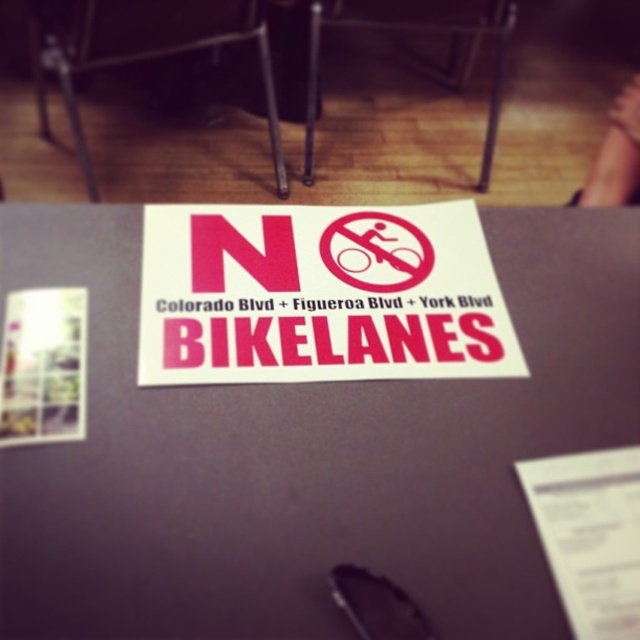
From the picture: You are standing at the origin point of the coordinate system. Which direction should you move to reach the purple matte paper at center?

The purple matte paper at center is located at coordinate point 0.711 on the x axis and 0.483 on the y axis. Since the origin is at the bottom left corner, moving towards the right and slightly upwards would reach the purple matte paper at center.